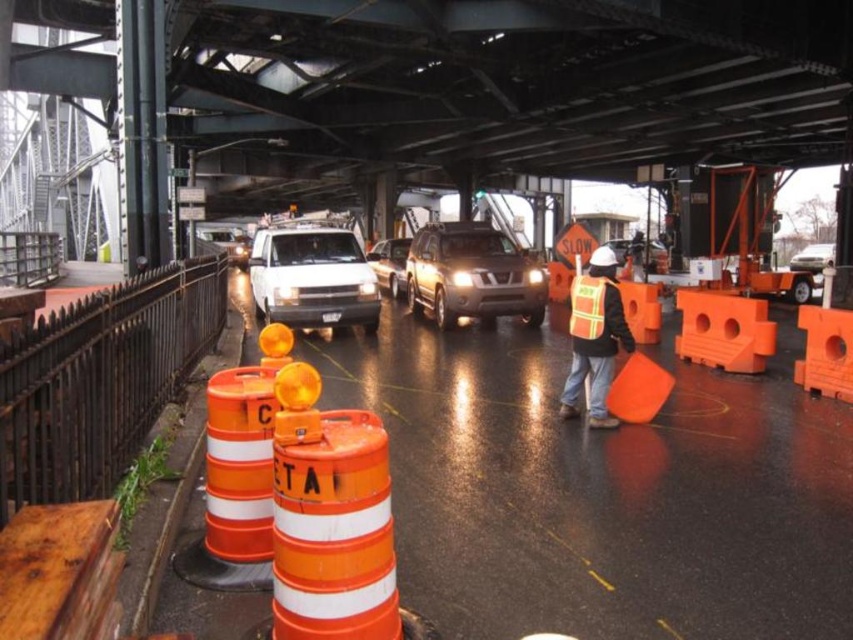
You are a delivery driver approaching the construction site. You need to pass through the area where the satin gold suv at center is located. Can you safely navigate around it based on its position?

The satin gold suv at center is located at point (473, 275), which means it is positioned in the central area of the scene. Since it is centrally located, you should proceed with caution and look for alternative pathways or follow any traffic directions provided by the worker to safely navigate around it.